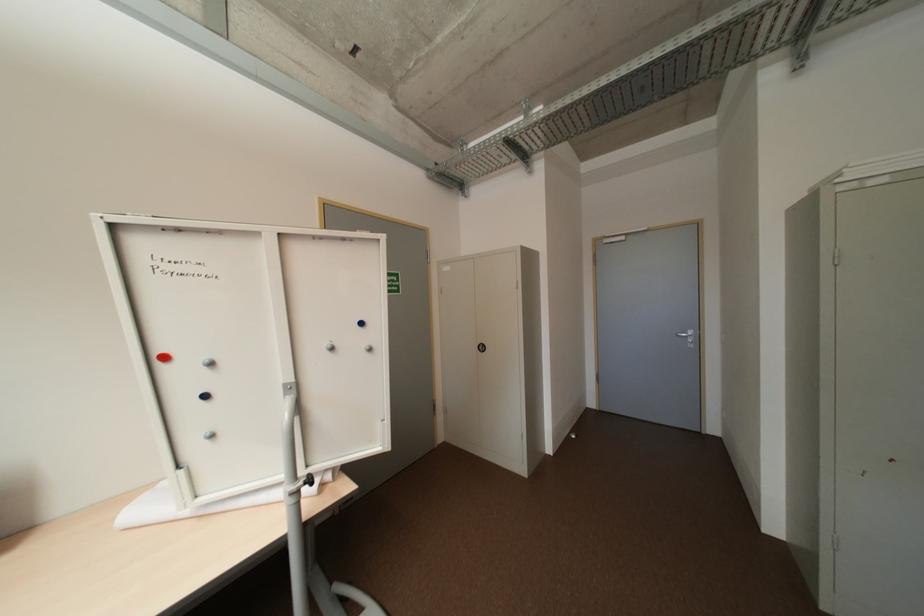
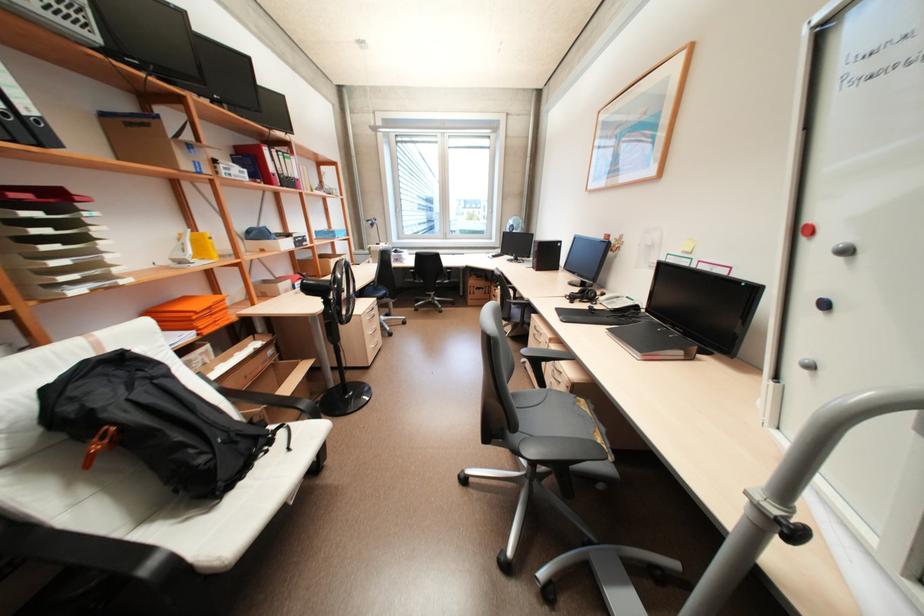
In the second image, find the point that corresponds to pixel 216 363 in the first image.

(852, 252)